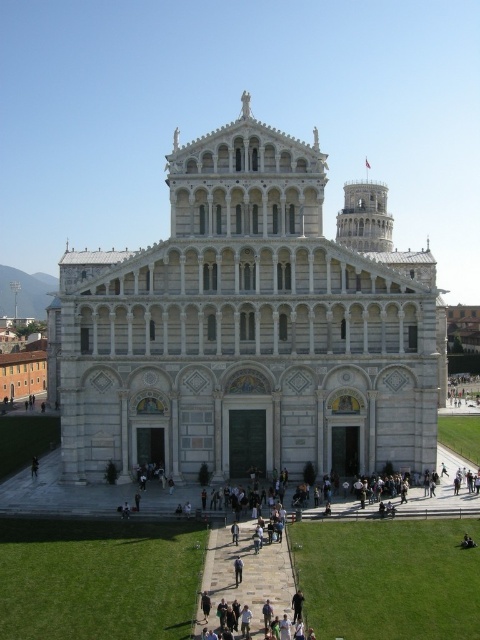
You are a GUI agent. You are given a task and a screenshot of the screen. Output one action in this format:
    pyautogui.click(x=<x>, y=<y>)
    Task: Click on the white stone cathedral at center
    This screenshot has width=480, height=640.
    Given the screenshot: What is the action you would take?
    pyautogui.click(x=252, y=326)

Does white stone cathedral at center have a greater width compared to dark blue jeans at lower left?

Indeed, white stone cathedral at center has a greater width compared to dark blue jeans at lower left.

The width and height of the screenshot is (480, 640). What are the coordinates of `white stone cathedral at center` in the screenshot? It's located at (252, 326).